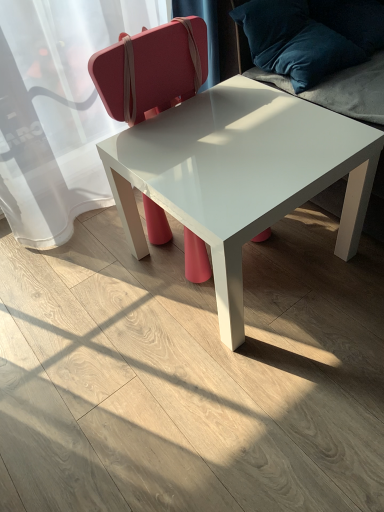
Question: Is white glossy table at center not within matte pink suitcase at center?

Choices:
 (A) yes
 (B) no

Answer: (B)

Question: Considering the relative positions of white glossy table at center and matte pink suitcase at center in the image provided, is white glossy table at center to the left of matte pink suitcase at center from the viewer's perspective?

Choices:
 (A) no
 (B) yes

Answer: (A)

Question: Is white glossy table at center taller than matte pink suitcase at center?

Choices:
 (A) yes
 (B) no

Answer: (B)

Question: Does white glossy table at center have a lesser height compared to matte pink suitcase at center?

Choices:
 (A) yes
 (B) no

Answer: (A)

Question: Would you consider white glossy table at center to be distant from matte pink suitcase at center?

Choices:
 (A) yes
 (B) no

Answer: (B)

Question: From a real-world perspective, is white glossy table at center located higher than matte pink suitcase at center?

Choices:
 (A) no
 (B) yes

Answer: (A)

Question: Considering the relative sizes of velvet blue pillow at upper right and white glossy table at center in the image provided, is velvet blue pillow at upper right thinner than white glossy table at center?

Choices:
 (A) no
 (B) yes

Answer: (B)

Question: Is velvet blue pillow at upper right shorter than white glossy table at center?

Choices:
 (A) yes
 (B) no

Answer: (A)

Question: Considering the relative positions of velvet blue pillow at upper right and white glossy table at center in the image provided, is velvet blue pillow at upper right behind white glossy table at center?

Choices:
 (A) no
 (B) yes

Answer: (B)

Question: Does velvet blue pillow at upper right lie in front of white glossy table at center?

Choices:
 (A) yes
 (B) no

Answer: (B)

Question: Could you tell me if velvet blue pillow at upper right is facing white glossy table at center?

Choices:
 (A) no
 (B) yes

Answer: (A)

Question: From a real-world perspective, is velvet blue pillow at upper right located beneath white glossy table at center?

Choices:
 (A) yes
 (B) no

Answer: (B)

Question: Is matte pink suitcase at center outside of velvet blue pillow at upper right?

Choices:
 (A) yes
 (B) no

Answer: (A)